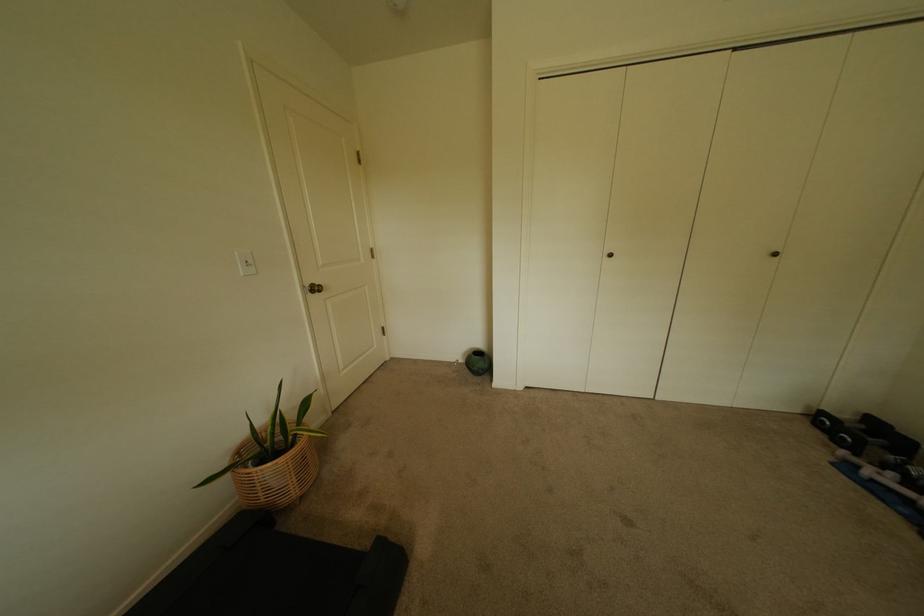
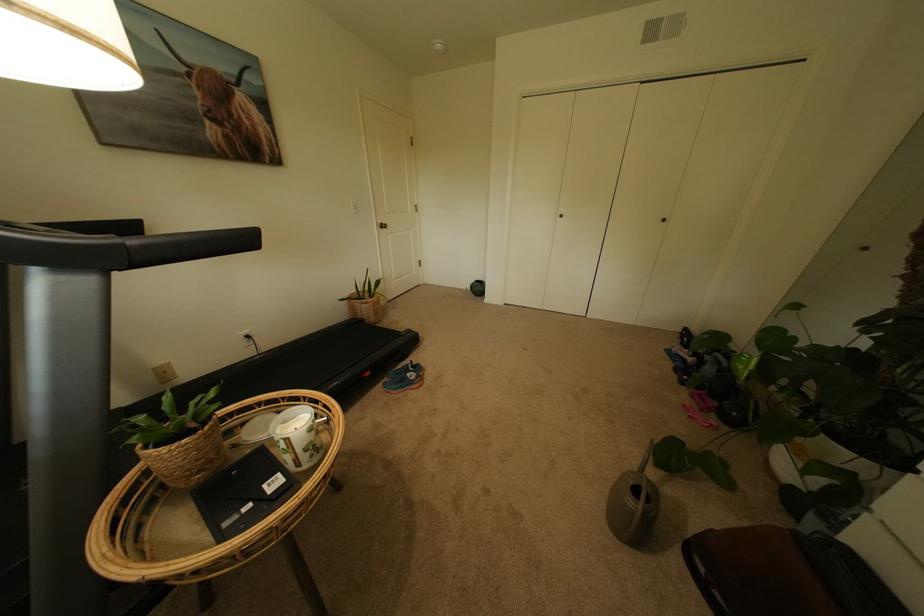
Where in the second image is the point corresponding to pixel 302 480 from the first image?

(382, 314)